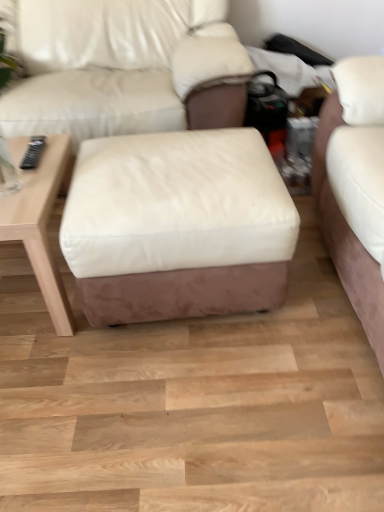
I want to click on vacant space in front of wooden table at left, so click(64, 379).